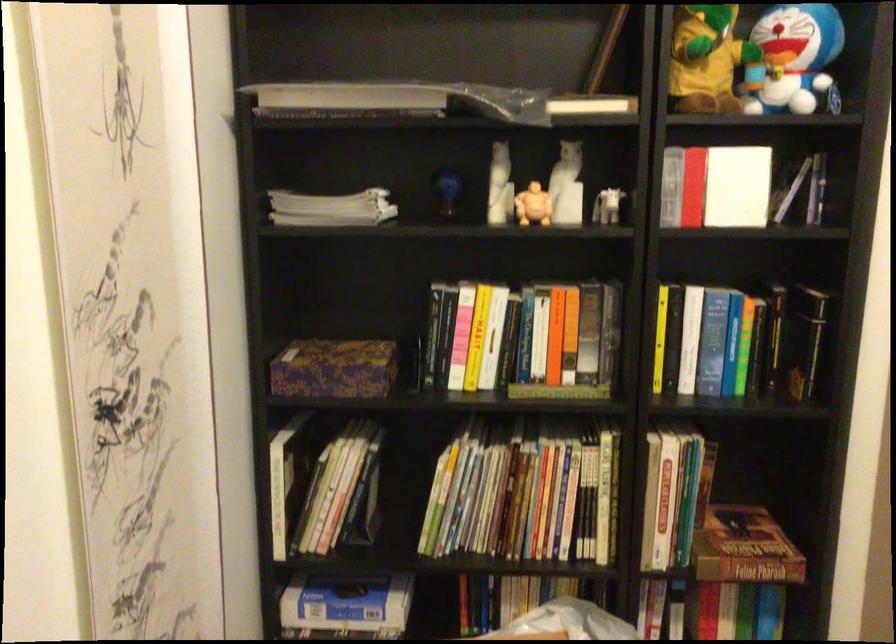
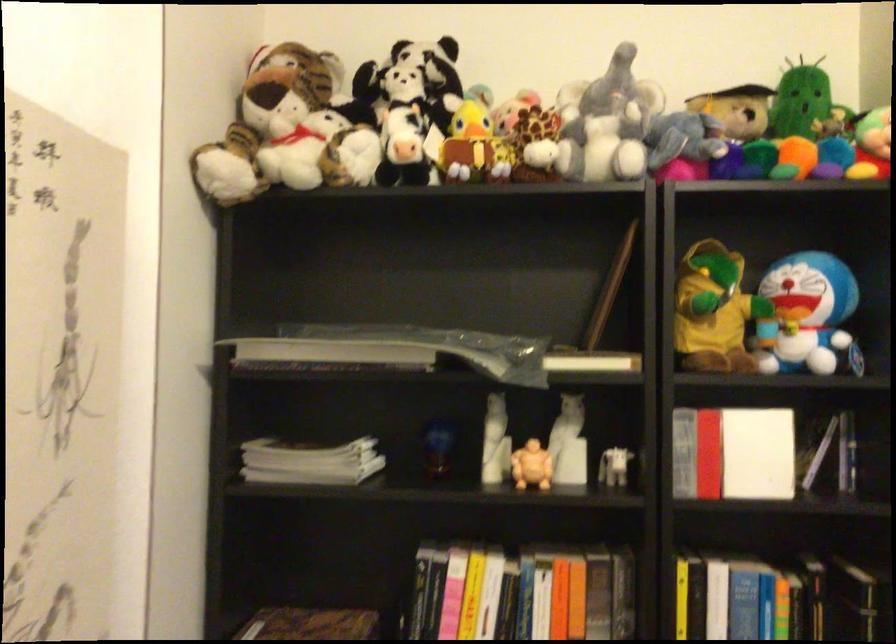
The point at [332,205] is marked in the first image. Where is the corresponding point in the second image?

(309, 462)